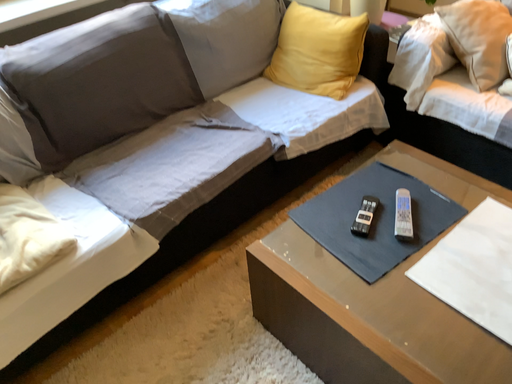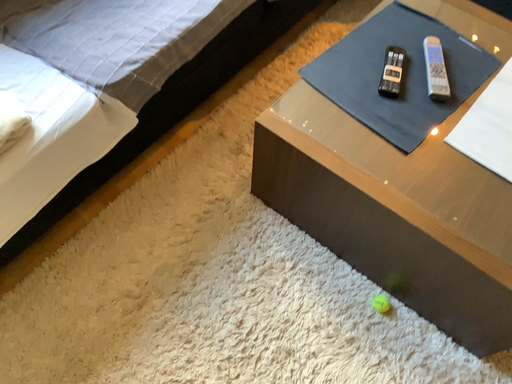
Question: How did the camera likely rotate when shooting the video?

Choices:
 (A) rotated upward
 (B) rotated downward

Answer: (B)